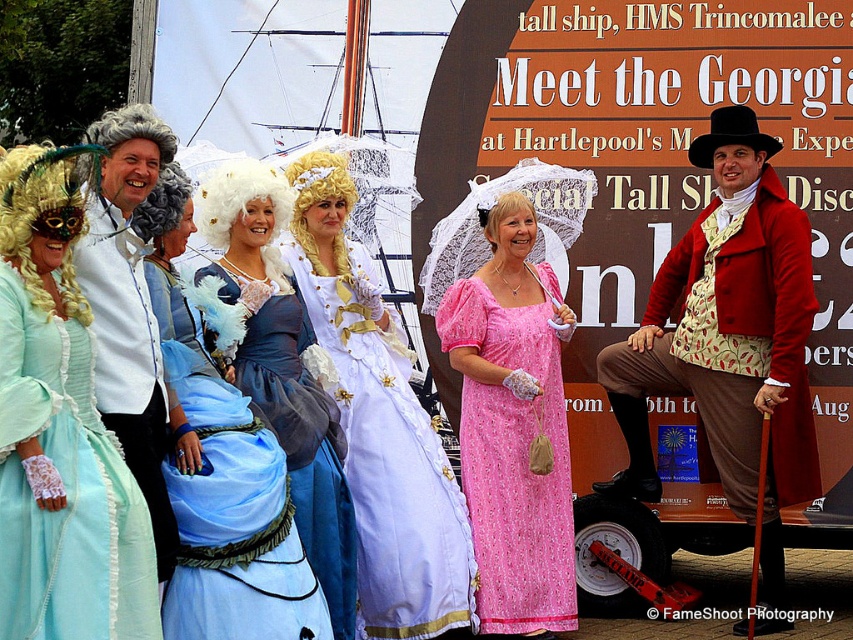
Who is positioned more to the left, pink satin dress at center or blue satin dress at center?

blue satin dress at center is more to the left.

Is pink satin dress at center smaller than blue satin dress at center?

Correct, pink satin dress at center occupies less space than blue satin dress at center.

The width and height of the screenshot is (853, 640). Find the location of `pink satin dress at center`. pink satin dress at center is located at coordinates (514, 435).

Does gray curly wig at upper left appear under blonde lace wig at center?

Incorrect, gray curly wig at upper left is not positioned below blonde lace wig at center.

Is gray curly wig at upper left closer to the viewer compared to blonde lace wig at center?

Yes, gray curly wig at upper left is in front of blonde lace wig at center.

Which is in front, point (160, 163) or point (529, 200)?

Point (160, 163)

Where is `gray curly wig at upper left`? The width and height of the screenshot is (853, 640). gray curly wig at upper left is located at coordinates (132, 131).

Can you confirm if blue satin dress at center is positioned below gray curly wig at upper left?

Indeed, blue satin dress at center is positioned under gray curly wig at upper left.

Is blue satin dress at center thinner than gray curly wig at upper left?

Yes, blue satin dress at center is thinner than gray curly wig at upper left.

Between point (337, 588) and point (114, 112), which one is positioned in front?

Point (337, 588)

Locate an element on the screen. Image resolution: width=853 pixels, height=640 pixels. blue satin dress at center is located at coordinates (283, 368).